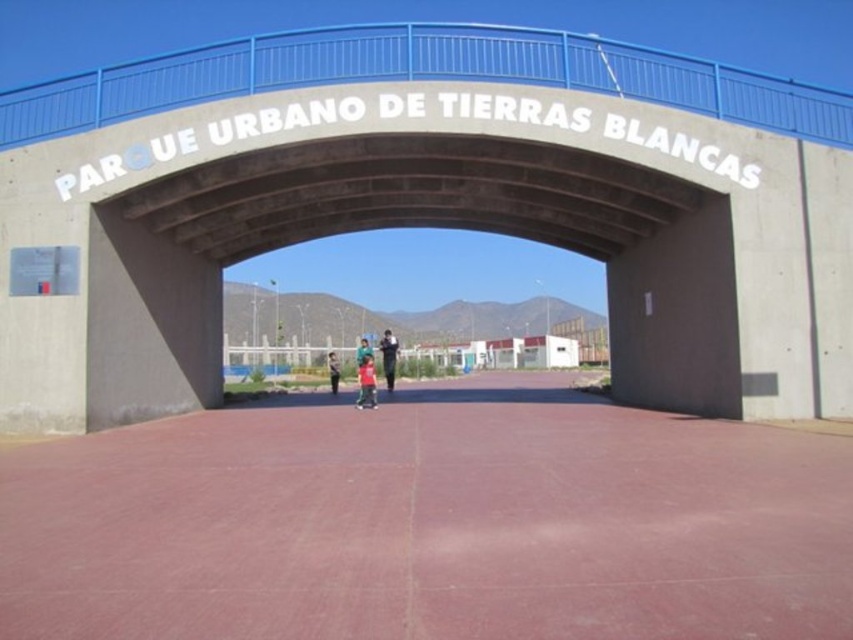
Looking at this image, you are standing at the entrance of Parque Urbano de Tierras Blancas and see the concrete bridge at center and the dark blue jeans at center. Which object is positioned to the right of the other?

The concrete bridge at center is to the right of the dark blue jeans at center.

You are at the entrance of Parque Urbano de Tierras Blancas and see a light brown leather jacket at center and a blue denim shirt at center. Which clothing item is smaller?

The light brown leather jacket at center is smaller than the blue denim shirt at center.